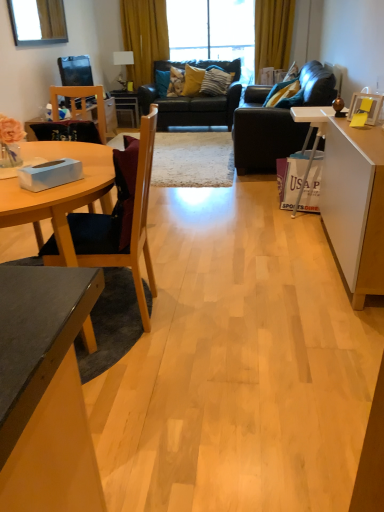
Question: Would you say matte white lamp at upper center contains velvet blue pillow at upper right, which is the 4th pillow from back to front?

Choices:
 (A) yes
 (B) no

Answer: (B)

Question: Considering the relative sizes of matte white lamp at upper center and velvet blue pillow at upper right, arranged as the first pillow when viewed from the right, in the image provided, is matte white lamp at upper center bigger than velvet blue pillow at upper right, arranged as the first pillow when viewed from the right,?

Choices:
 (A) no
 (B) yes

Answer: (A)

Question: From a real-world perspective, is matte white lamp at upper center on velvet blue pillow at upper right, positioned as the 1th pillow in front-to-back order?

Choices:
 (A) no
 (B) yes

Answer: (B)

Question: Is matte white lamp at upper center thinner than velvet blue pillow at upper right, the 4th pillow viewed from the left?

Choices:
 (A) no
 (B) yes

Answer: (B)

Question: Does matte white lamp at upper center have a greater width compared to velvet blue pillow at upper right, arranged as the first pillow when viewed from the right?

Choices:
 (A) yes
 (B) no

Answer: (B)

Question: From the image's perspective, relative to yellow fabric pillow at center, positioned as the third pillow in front-to-back order, is black leather couch at center, which is the 1th studio couch from back to front, above or below?

Choices:
 (A) above
 (B) below

Answer: (B)

Question: From a real-world perspective, is black leather couch at center, which is the 1th studio couch from back to front, positioned above or below yellow fabric pillow at center, placed as the 3th pillow when sorted from right to left?

Choices:
 (A) below
 (B) above

Answer: (A)

Question: Is black leather couch at center, marked as the second studio couch in a front-to-back arrangement, bigger or smaller than yellow fabric pillow at center, arranged as the second pillow when viewed from the back?

Choices:
 (A) small
 (B) big

Answer: (B)

Question: In terms of width, does black leather couch at center, which is the 1th studio couch from back to front, look wider or thinner when compared to yellow fabric pillow at center, arranged as the second pillow when viewed from the back?

Choices:
 (A) wide
 (B) thin

Answer: (A)

Question: Visually, is velvet blue pillow at upper right, arranged as the first pillow when viewed from the right, positioned to the left or to the right of velvet yellow pillow at center, acting as the fourth pillow starting from the right?

Choices:
 (A) left
 (B) right

Answer: (B)

Question: Is point (283, 94) closer or farther from the camera than point (182, 77)?

Choices:
 (A) farther
 (B) closer

Answer: (B)

Question: Is velvet blue pillow at upper right, positioned as the 1th pillow in front-to-back order, wider or thinner than velvet yellow pillow at center, acting as the fourth pillow starting from the right?

Choices:
 (A) thin
 (B) wide

Answer: (A)

Question: From the image's perspective, is velvet blue pillow at upper right, which is the 4th pillow from back to front, located above or below velvet yellow pillow at center, acting as the first pillow starting from the left?

Choices:
 (A) above
 (B) below

Answer: (B)

Question: From the image's perspective, is wooden picture frame at right located above or below transparent glass window at upper center?

Choices:
 (A) below
 (B) above

Answer: (A)

Question: Is wooden picture frame at right in front of or behind transparent glass window at upper center in the image?

Choices:
 (A) behind
 (B) front

Answer: (B)